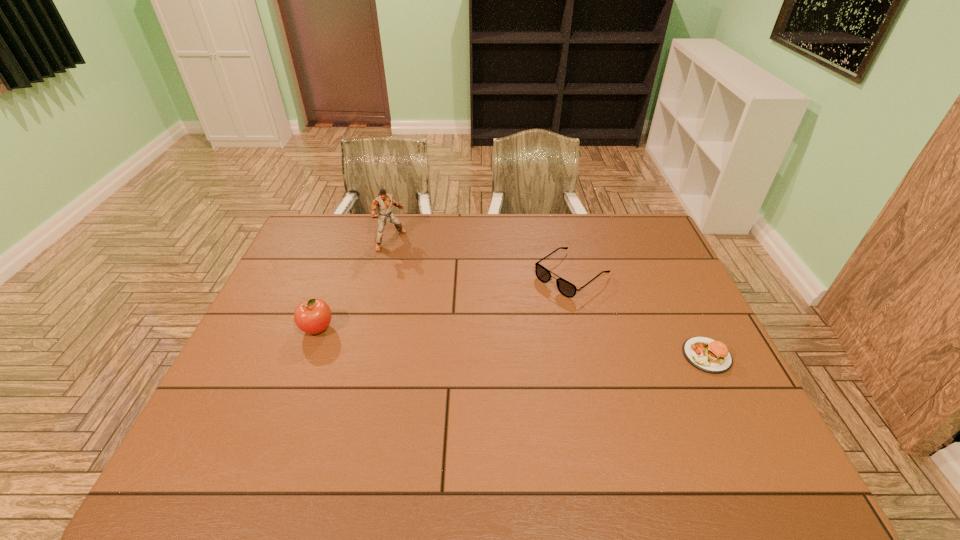
Where is `blank area in the image that satisfies the following two spatial constraints: 1. on the back side of the apple; 2. on the right side of the puncher`? The width and height of the screenshot is (960, 540). blank area in the image that satisfies the following two spatial constraints: 1. on the back side of the apple; 2. on the right side of the puncher is located at coordinates (350, 240).

At what (x,y) coordinates should I click in order to perform the action: click on blank area in the image that satisfies the following two spatial constraints: 1. on the back side of the third object from left to right; 2. on the right side of the leftmost object. Please return your answer as a coordinate pair (x, y). This screenshot has height=540, width=960. Looking at the image, I should click on click(337, 274).

Where is `vacant area in the image that satisfies the following two spatial constraints: 1. on the front side of the tallest object; 2. on the left side of the patty`? vacant area in the image that satisfies the following two spatial constraints: 1. on the front side of the tallest object; 2. on the left side of the patty is located at coordinates (363, 355).